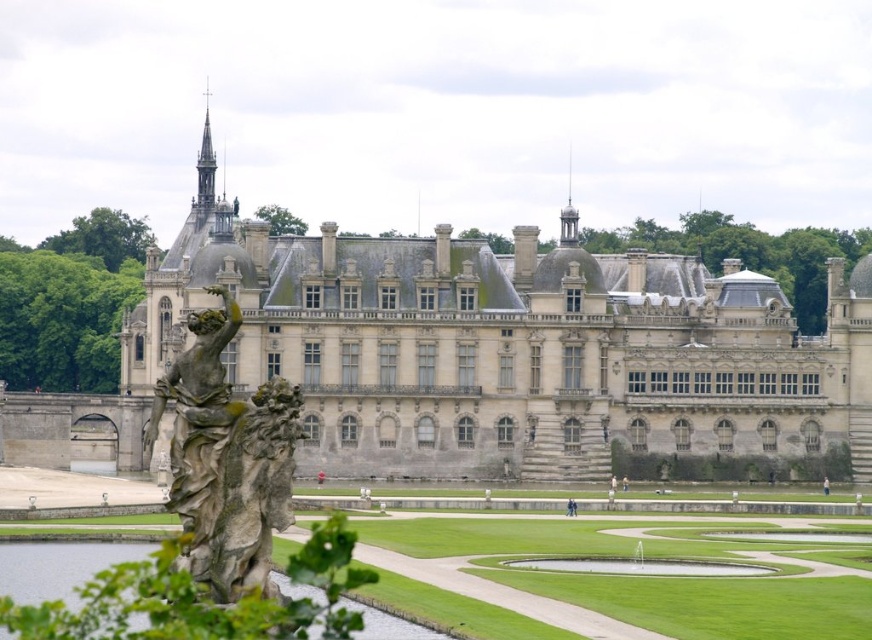
Between stone castle at center and clear water at statue left, which one appears on the left side from the viewer's perspective?

Positioned to the left is clear water at statue left.

Is stone castle at center further to the viewer compared to clear water at statue left?

Yes, stone castle at center is further from the viewer.

Image resolution: width=872 pixels, height=640 pixels. Find the location of `stone castle at center`. stone castle at center is located at coordinates (508, 346).

The height and width of the screenshot is (640, 872). I want to click on stone castle at center, so click(x=508, y=346).

Who is taller, stone castle at center or stone statue at left?

Standing taller between the two is stone castle at center.

Is point (576, 282) in front of point (181, 502)?

No, (576, 282) is behind (181, 502).

You are a GUI agent. You are given a task and a screenshot of the screen. Output one action in this format:
    pyautogui.click(x=<x>, y=<y>)
    Task: Click on the stone castle at center
    
    Given the screenshot: What is the action you would take?
    pyautogui.click(x=508, y=346)

Which is more to the right, stone statue at left or clear water at statue left?

clear water at statue left

Does stone statue at left appear on the left side of clear water at statue left?

Indeed, stone statue at left is positioned on the left side of clear water at statue left.

Does point (247, 541) lie in front of point (11, 589)?

Yes, it is.

Where is `stone statue at left`? Image resolution: width=872 pixels, height=640 pixels. stone statue at left is located at coordinates (226, 460).